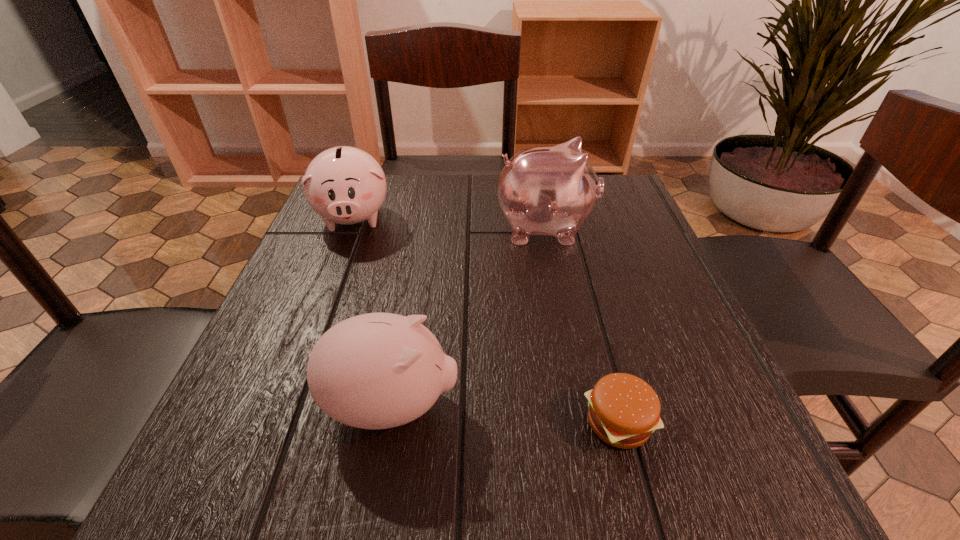
The height and width of the screenshot is (540, 960). I want to click on free spot between the nearest piggy bank and the rightmost piggy bank, so click(468, 316).

The height and width of the screenshot is (540, 960). In order to click on free space between the shortest object and the nearest piggy bank in this screenshot , I will do `click(505, 414)`.

Image resolution: width=960 pixels, height=540 pixels. What are the coordinates of `free space between the tallest object and the shortest object` in the screenshot? It's located at (582, 325).

This screenshot has height=540, width=960. I want to click on free space that is in between the hamburger and the tallest object, so click(582, 325).

Find the location of `object that is the closest to the nearest piggy bank`. object that is the closest to the nearest piggy bank is located at coordinates click(624, 410).

Identify which object is the third nearest to the rightmost piggy bank. Please provide its 2D coordinates. Your answer should be formatted as a tuple, i.e. [(x, y)], where the tuple contains the x and y coordinates of a point satisfying the conditions above.

[(624, 410)]

Locate an element on the screen. piggy bank identified as the second closest to the shortest object is located at coordinates (551, 190).

At what (x,y) coordinates should I click in order to perform the action: click on piggy bank that is the second nearest to the tallest piggy bank. Please return your answer as a coordinate pair (x, y). This screenshot has height=540, width=960. Looking at the image, I should click on (377, 370).

Find the location of a particular element. free region that satisfies the following two spatial constraints: 1. at the snout of the nearest piggy bank; 2. on the right side of the hamburger is located at coordinates (389, 422).

Where is `vacant space that satisfies the following two spatial constraints: 1. at the snout of the nearest piggy bank; 2. on the back side of the hamburger`? The image size is (960, 540). vacant space that satisfies the following two spatial constraints: 1. at the snout of the nearest piggy bank; 2. on the back side of the hamburger is located at coordinates (389, 422).